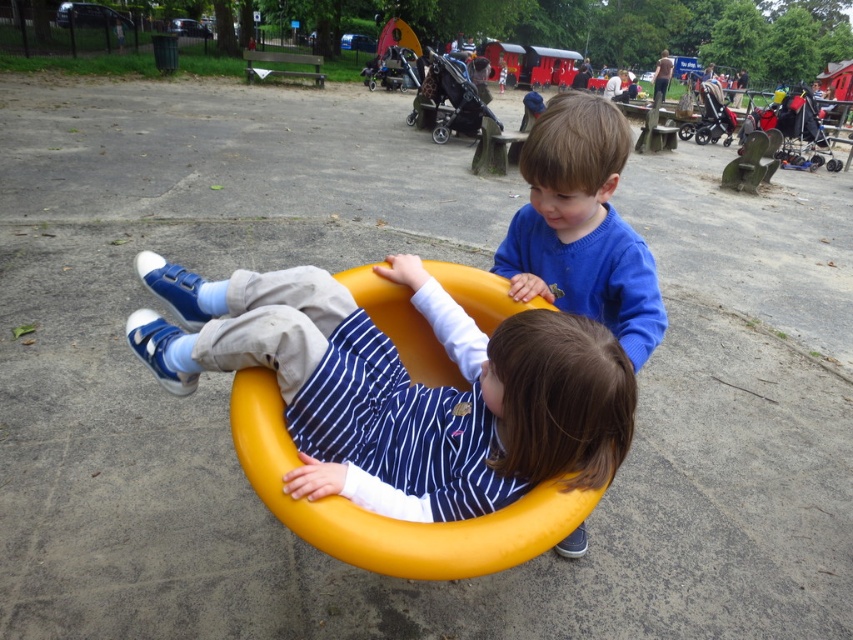
Who is taller, matte yellow swing at center or blue knit sweater at upper center?

With more height is blue knit sweater at upper center.

Who is lower down, matte yellow swing at center or blue knit sweater at upper center?

matte yellow swing at center is lower down.

This screenshot has width=853, height=640. What are the coordinates of `matte yellow swing at center` in the screenshot? It's located at click(x=402, y=387).